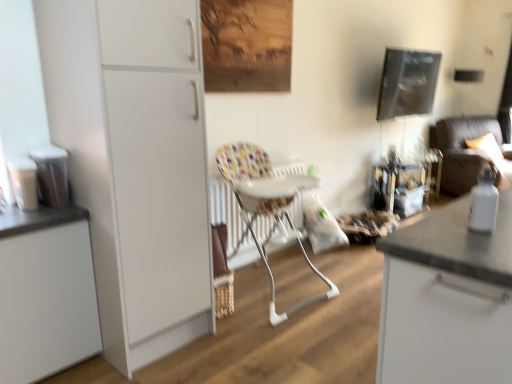
Locate an element on the screen. vacant area that is in front of printed fabric highchair at center is located at coordinates (284, 346).